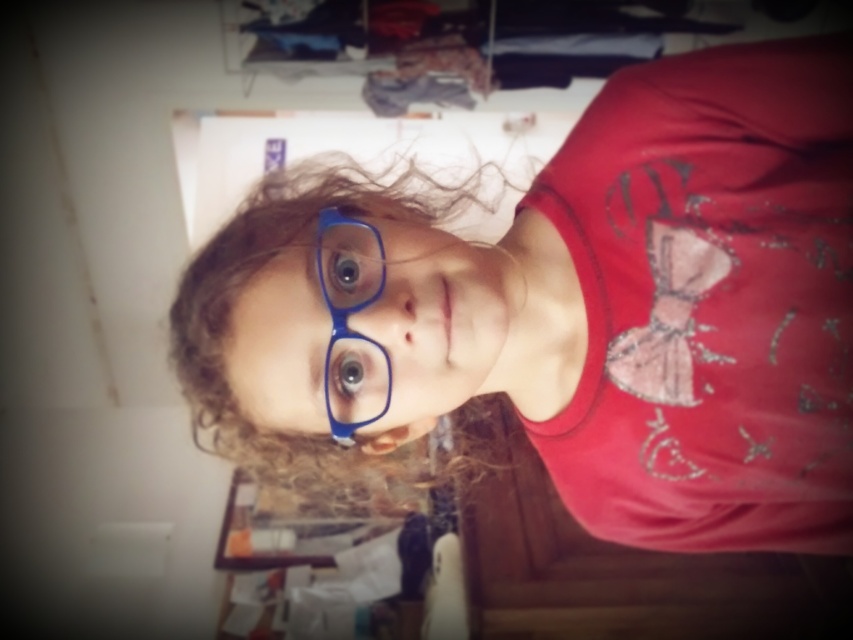
Who is positioned more to the left, matte blue glasses at center or blue glassy eye at center?

blue glassy eye at center is more to the left.

How distant is matte blue glasses at center from blue glassy eye at center?

They are 9.55 inches apart.

Which is behind, point (679, 236) or point (337, 262)?

Point (679, 236)

In order to click on matte blue glasses at center in this screenshot , I will do `click(573, 312)`.

Consider the image. Does matte blue glasses at center have a lesser height compared to blue plastic glasses at center?

No, matte blue glasses at center is not shorter than blue plastic glasses at center.

Who is more distant from viewer, (252, 244) or (354, 355)?

The point (252, 244) is more distant.

The height and width of the screenshot is (640, 853). What are the coordinates of `matte blue glasses at center` in the screenshot? It's located at (573, 312).

Between curly brown hair at center and blue glassy eye at center, which one is positioned lower?

curly brown hair at center

Which is in front, point (198, 282) or point (352, 284)?

Point (352, 284)

Locate an element on the screen. The width and height of the screenshot is (853, 640). curly brown hair at center is located at coordinates (328, 340).